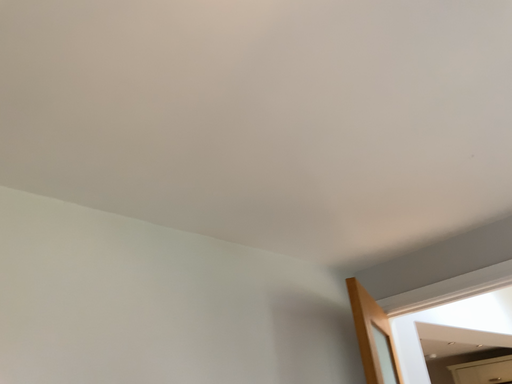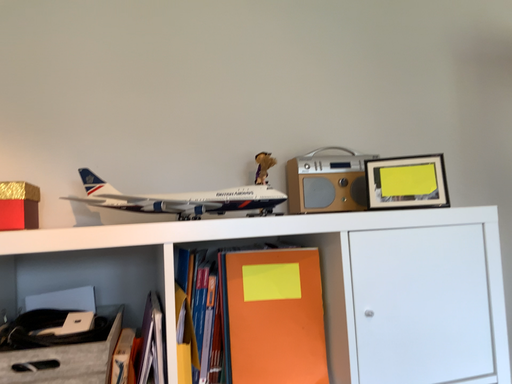
Question: Which way did the camera rotate in the video?

Choices:
 (A) rotated right
 (B) rotated left

Answer: (B)